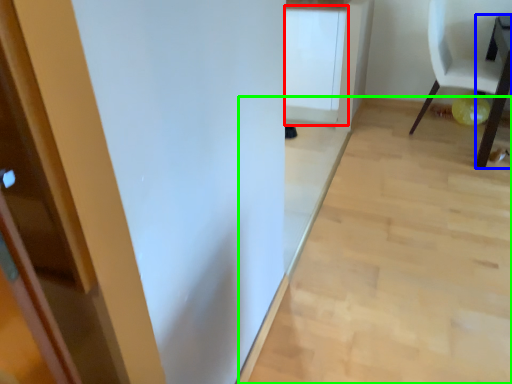
Question: Which object is positioned closest to cabinetry (highlighted by a red box)? Select from table (highlighted by a blue box) and plain (highlighted by a green box).

Choices:
 (A) table
 (B) plain

Answer: (B)